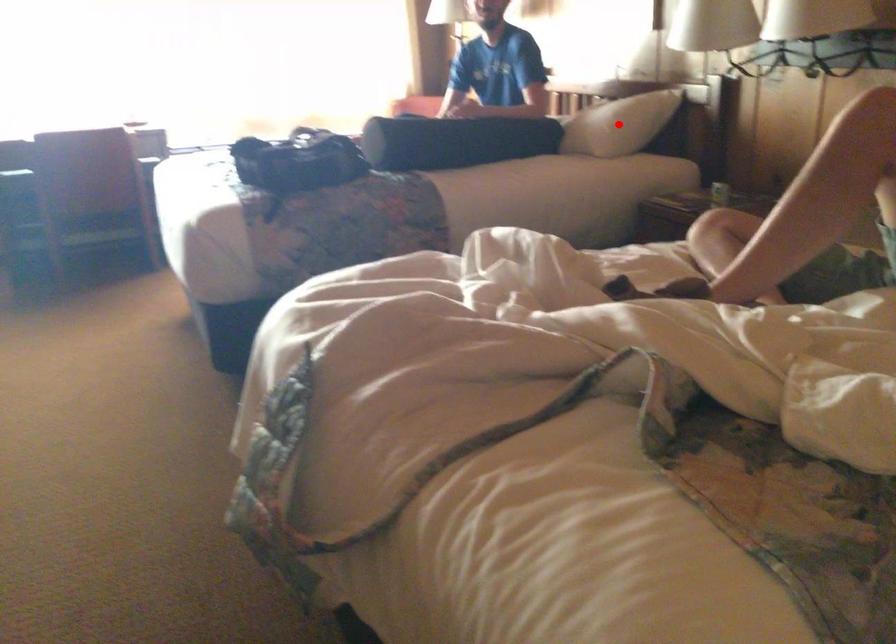
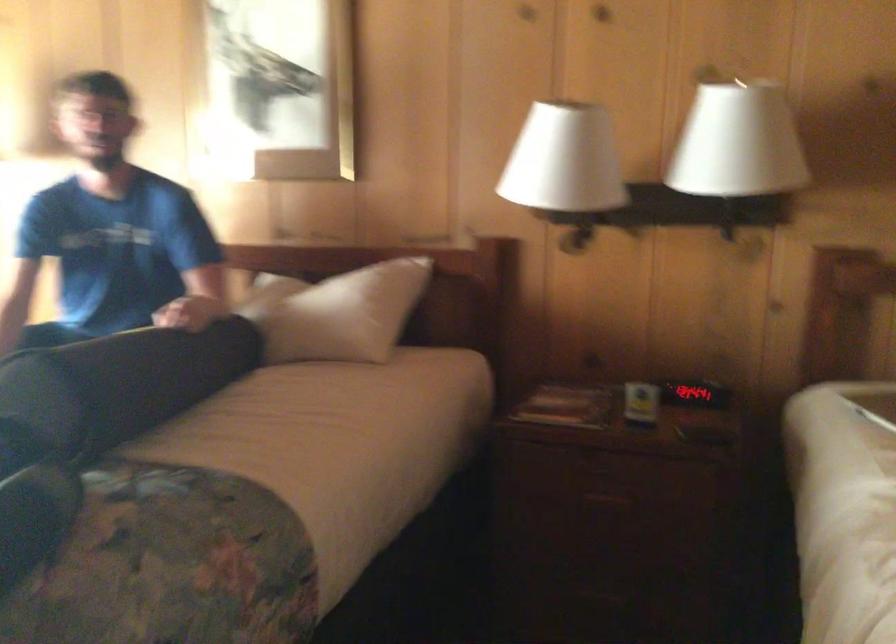
Question: I am providing you with two images of the same scene from different viewpoints. A red point is marked on the first image. Can you still see the location of the red point in image 2?

Choices:
 (A) Yes
 (B) No

Answer: (B)